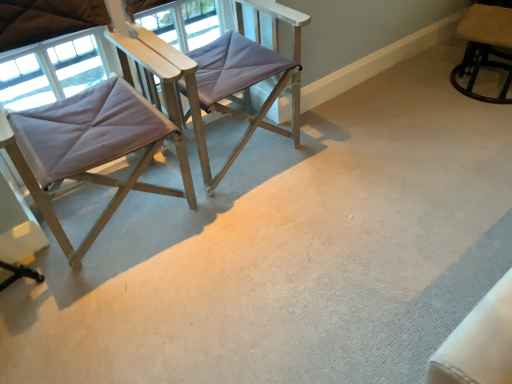
Question: Is beige fabric chair at upper right, the first chair when ordered from right to left, not within matte purple fabric chair at center, marked as the second chair in a left-to-right arrangement?

Choices:
 (A) yes
 (B) no

Answer: (A)

Question: From a real-world perspective, is beige fabric chair at upper right, the first chair when ordered from right to left, below matte purple fabric chair at center, marked as the 2th chair in a right-to-left arrangement?

Choices:
 (A) yes
 (B) no

Answer: (A)

Question: Is beige fabric chair at upper right, the first chair when ordered from right to left, in front of matte purple fabric chair at center, marked as the second chair in a left-to-right arrangement?

Choices:
 (A) no
 (B) yes

Answer: (A)

Question: Is beige fabric chair at upper right, which is counted as the 3th chair, starting from the left, shorter than matte purple fabric chair at center, marked as the second chair in a left-to-right arrangement?

Choices:
 (A) yes
 (B) no

Answer: (A)

Question: From the image's perspective, is beige fabric chair at upper right, which is counted as the 3th chair, starting from the left, on top of matte purple fabric chair at center, marked as the 2th chair in a right-to-left arrangement?

Choices:
 (A) no
 (B) yes

Answer: (B)

Question: Relative to matte gray fabric chair at left, marked as the first chair in a left-to-right arrangement, is beige fabric chair at upper right, the first chair when ordered from right to left, in front or behind?

Choices:
 (A) behind
 (B) front

Answer: (A)

Question: Considering the positions of beige fabric chair at upper right, the first chair when ordered from right to left, and matte gray fabric chair at left, marked as the first chair in a left-to-right arrangement, in the image, is beige fabric chair at upper right, the first chair when ordered from right to left, bigger or smaller than matte gray fabric chair at left, marked as the first chair in a left-to-right arrangement,?

Choices:
 (A) small
 (B) big

Answer: (A)

Question: In the image, is beige fabric chair at upper right, the first chair when ordered from right to left, on the left side or the right side of matte gray fabric chair at left, placed as the 3th chair when sorted from right to left?

Choices:
 (A) right
 (B) left

Answer: (A)

Question: From the image's perspective, is beige fabric chair at upper right, the first chair when ordered from right to left, located above or below matte gray fabric chair at left, placed as the 3th chair when sorted from right to left?

Choices:
 (A) above
 (B) below

Answer: (A)

Question: Relative to matte purple fabric chair at center, marked as the second chair in a left-to-right arrangement, is matte gray fabric chair at left, marked as the first chair in a left-to-right arrangement, in front or behind?

Choices:
 (A) behind
 (B) front

Answer: (B)

Question: From a real-world perspective, is matte gray fabric chair at left, placed as the 3th chair when sorted from right to left, physically located above or below matte purple fabric chair at center, marked as the second chair in a left-to-right arrangement?

Choices:
 (A) above
 (B) below

Answer: (A)

Question: Is matte gray fabric chair at left, placed as the 3th chair when sorted from right to left, bigger or smaller than matte purple fabric chair at center, marked as the 2th chair in a right-to-left arrangement?

Choices:
 (A) small
 (B) big

Answer: (A)

Question: From their relative heights in the image, would you say matte gray fabric chair at left, marked as the first chair in a left-to-right arrangement, is taller or shorter than matte purple fabric chair at center, marked as the second chair in a left-to-right arrangement?

Choices:
 (A) short
 (B) tall

Answer: (B)

Question: Is matte purple fabric chair at center, marked as the 2th chair in a right-to-left arrangement, spatially inside matte gray fabric chair at left, placed as the 3th chair when sorted from right to left, or outside of it?

Choices:
 (A) inside
 (B) outside

Answer: (B)

Question: Visually, is matte purple fabric chair at center, marked as the second chair in a left-to-right arrangement, positioned to the left or to the right of matte gray fabric chair at left, placed as the 3th chair when sorted from right to left?

Choices:
 (A) left
 (B) right

Answer: (B)